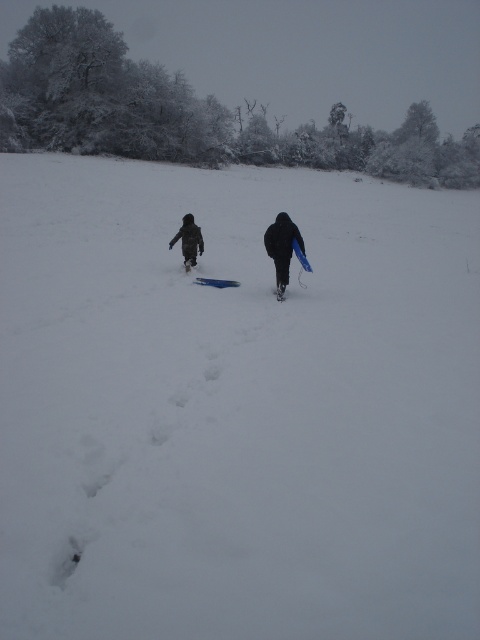
Is dark blue plastic sled at center in front of black matte jacket at center?

Yes, it is in front of black matte jacket at center.

Is dark blue plastic sled at center smaller than black matte jacket at center?

Yes, dark blue plastic sled at center is smaller than black matte jacket at center.

The width and height of the screenshot is (480, 640). I want to click on dark blue plastic sled at center, so click(x=283, y=244).

Identify the location of black matte jacket at center. (282, 248).

Is the position of black matte jacket at center more distant than that of blue plastic ski at center?

That is False.

Is point (283, 241) closer to viewer compared to point (203, 278)?

Yes, it is in front of point (203, 278).

Find the location of a particular element. black matte jacket at center is located at coordinates (282, 248).

Can you confirm if black matte jacket at center is taller than black matte snowshoe at center?

Indeed, black matte jacket at center has a greater height compared to black matte snowshoe at center.

Can you confirm if black matte jacket at center is wider than black matte snowshoe at center?

Yes.

Between point (265, 234) and point (284, 291), which one is positioned in front?

Positioned in front is point (284, 291).

Identify the location of black matte jacket at center. (282, 248).